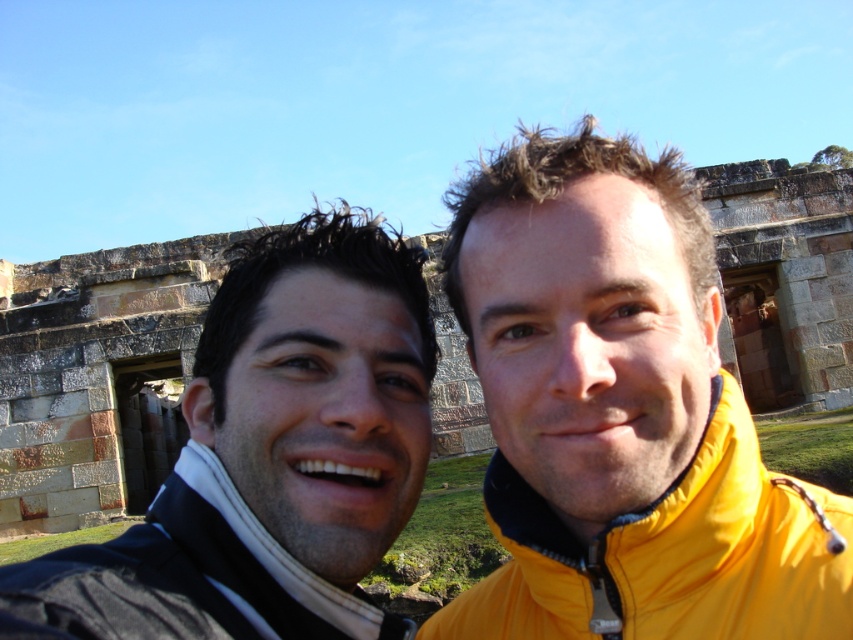
Question: Among these objects, which one is farthest from the camera?

Choices:
 (A) dark blue fleece jacket at center
 (B) dark brown hair at center
 (C) yellow fabric jacket at right

Answer: (C)

Question: Among these objects, which one is farthest from the camera?

Choices:
 (A) yellow fabric jacket at right
 (B) dark brown hair at center
 (C) dark blue fleece jacket at center

Answer: (A)

Question: Does yellow fabric jacket at right have a lesser width compared to dark blue fleece jacket at center?

Choices:
 (A) no
 (B) yes

Answer: (A)

Question: Which object is the farthest from the yellow fabric jacket at right?

Choices:
 (A) dark brown hair at center
 (B) dark blue fleece jacket at center

Answer: (B)

Question: Can you confirm if yellow fabric jacket at right is smaller than dark blue fleece jacket at center?

Choices:
 (A) no
 (B) yes

Answer: (A)

Question: Does dark brown hair at center appear on the right side of dark blue fleece jacket at center?

Choices:
 (A) no
 (B) yes

Answer: (B)